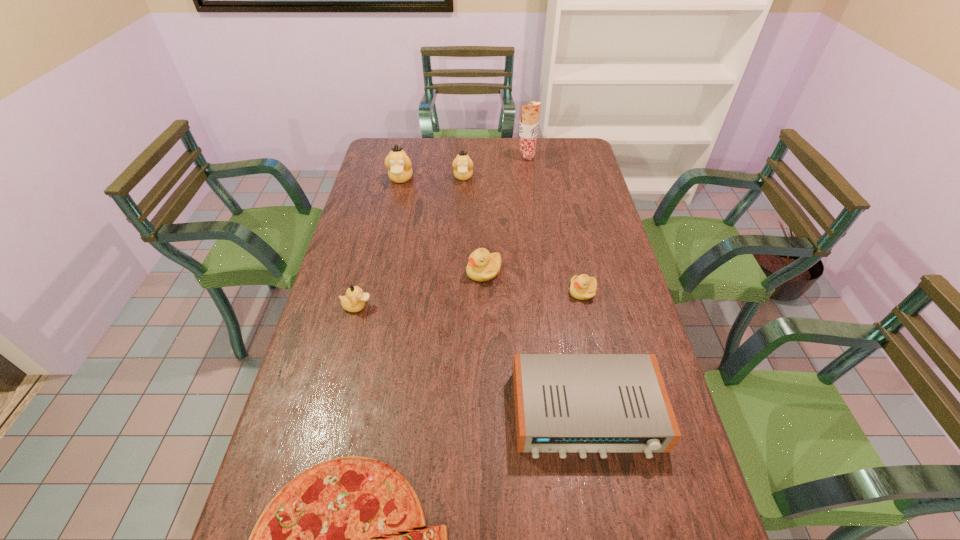
Where is `the tallest object`? the tallest object is located at coordinates (528, 127).

At what (x,y) coordinates should I click in order to perform the action: click on the farthest object. Please return your answer as a coordinate pair (x, y). Image resolution: width=960 pixels, height=540 pixels. Looking at the image, I should click on (528, 127).

The width and height of the screenshot is (960, 540). In order to click on the tallest duckling in this screenshot , I will do [x=399, y=165].

Find the location of a particular element. This screenshot has width=960, height=540. the biggest tan duckling is located at coordinates (399, 165).

I want to click on the second tallest duckling, so click(x=463, y=166).

The height and width of the screenshot is (540, 960). Identify the location of the second biggest tan duckling. [x=463, y=166].

Find the location of a particular element. The width and height of the screenshot is (960, 540). the bigger yellow duckling is located at coordinates (482, 266).

The image size is (960, 540). I want to click on the nearest tan duckling, so click(354, 301).

The image size is (960, 540). Find the location of `radio receiver`. radio receiver is located at coordinates (582, 403).

The image size is (960, 540). Identify the location of the smaller yellow duckling. (583, 287).